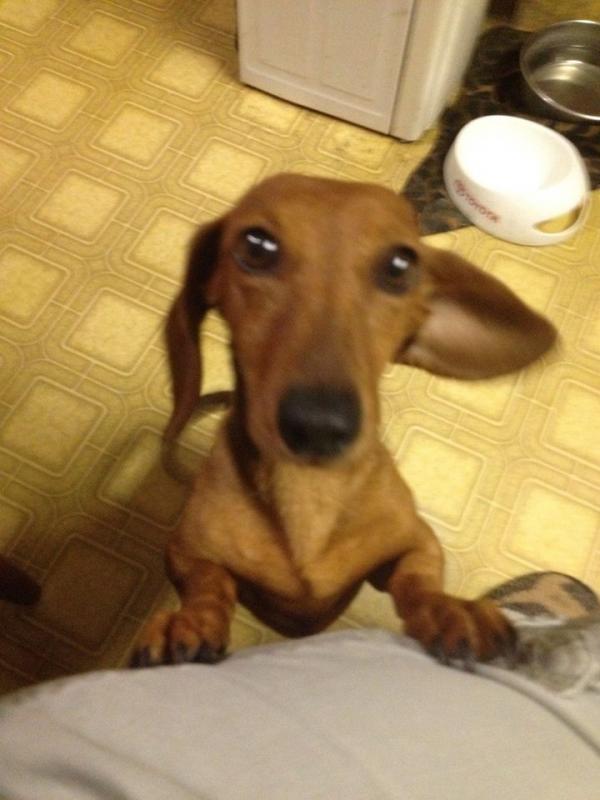
Identify the location of nasty yellowish floor. The width and height of the screenshot is (600, 800). (41, 514).